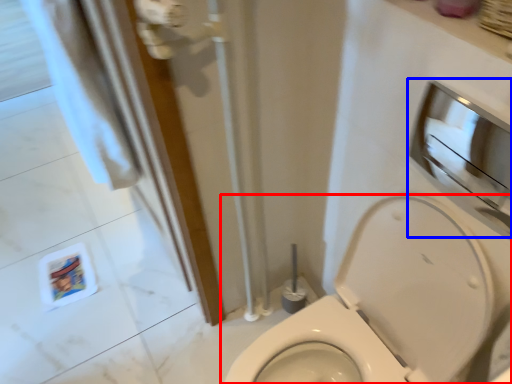
Question: Which point is further to the camera, toilet (highlighted by a red box) or medicine cabinet (highlighted by a blue box)?

Choices:
 (A) toilet
 (B) medicine cabinet

Answer: (B)